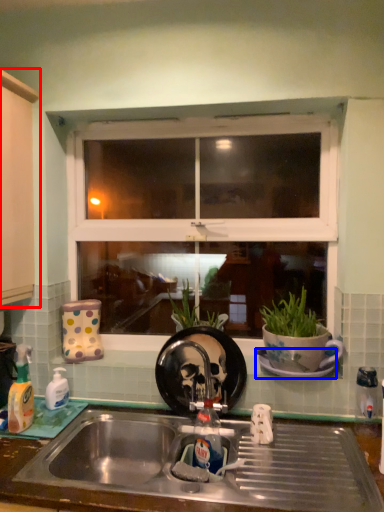
Question: Which of the following is the closest to the observer, cabinetry (highlighted by a red box) or saucer (highlighted by a blue box)?

Choices:
 (A) cabinetry
 (B) saucer

Answer: (A)